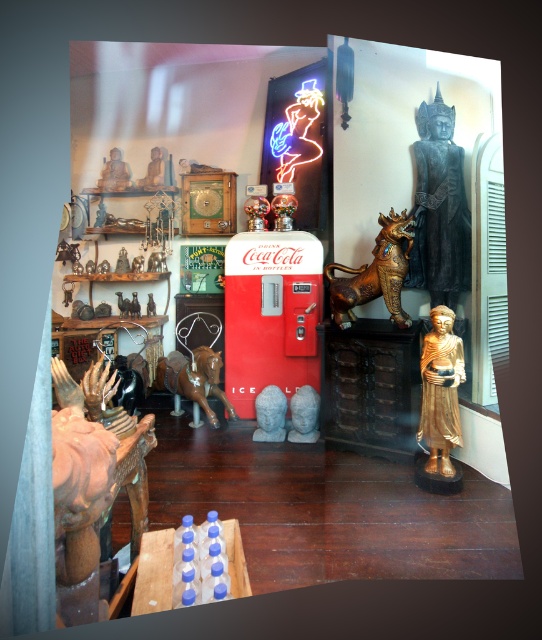
Question: Among these objects, which one is nearest to the camera?

Choices:
 (A) gold polished statue at right
 (B) matte gold statue at upper left
 (C) wooden statue at lower left

Answer: (C)

Question: Which object is the closest to the wooden statue at lower left?

Choices:
 (A) black polished wood statue at upper right
 (B) gray stone bust at center
 (C) bronze/golden statue at center-right
 (D) brown wooden horse at center

Answer: (C)

Question: Considering the real-world distances, which object is farthest from the wooden statue at lower left?

Choices:
 (A) bronze/golden statue at center-right
 (B) gold polished statue at right
 (C) matte gold statue at center
 (D) matte gold statue at upper left

Answer: (D)

Question: Does wooden statue at lower left appear on the right side of white stone heads at center?

Choices:
 (A) yes
 (B) no

Answer: (B)

Question: Does wooden statue at lower left appear under white stone heads at center?

Choices:
 (A) no
 (B) yes

Answer: (A)

Question: Can you confirm if bronze/golden statue at center-right is wider than gray stone bust at center?

Choices:
 (A) no
 (B) yes

Answer: (B)